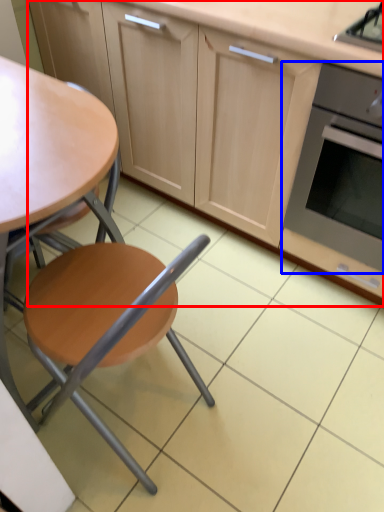
Question: Which object is further to the camera taking this photo, cabinetry (highlighted by a red box) or kitchen appliance (highlighted by a blue box)?

Choices:
 (A) cabinetry
 (B) kitchen appliance

Answer: (B)